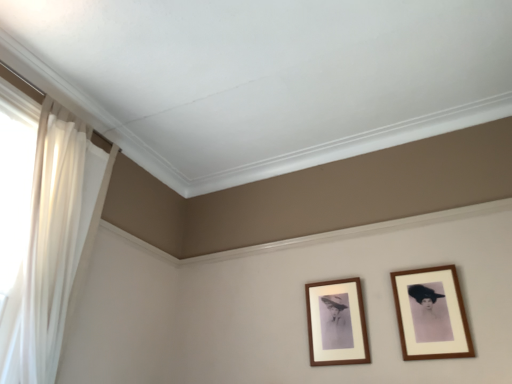
Question: Is wooden frame at center, arranged as the 1th picture frame when viewed from the left, smaller than white sheer curtain at left?

Choices:
 (A) no
 (B) yes

Answer: (B)

Question: Could white sheer curtain at left be considered to be inside wooden frame at center, the second picture frame when ordered from right to left?

Choices:
 (A) no
 (B) yes

Answer: (A)

Question: Is wooden frame at center, the second picture frame when ordered from right to left, placed right next to white sheer curtain at left?

Choices:
 (A) yes
 (B) no

Answer: (B)

Question: Is wooden frame at center, arranged as the 1th picture frame when viewed from the left, shorter than white sheer curtain at left?

Choices:
 (A) no
 (B) yes

Answer: (B)

Question: From the image's perspective, is wooden frame at center, arranged as the 1th picture frame when viewed from the left, on top of white sheer curtain at left?

Choices:
 (A) no
 (B) yes

Answer: (A)

Question: Is wooden frame at center, arranged as the 1th picture frame when viewed from the left, completely or partially outside of white sheer curtain at left?

Choices:
 (A) yes
 (B) no

Answer: (A)

Question: Does white sheer curtain at left appear on the right side of wooden frame at right, which is counted as the second picture frame, starting from the left?

Choices:
 (A) yes
 (B) no

Answer: (B)

Question: Is white sheer curtain at left in contact with wooden frame at right, which is the first picture frame from right to left?

Choices:
 (A) no
 (B) yes

Answer: (A)

Question: Would you say white sheer curtain at left is a long distance from wooden frame at right, which is counted as the second picture frame, starting from the left?

Choices:
 (A) no
 (B) yes

Answer: (B)

Question: Is white sheer curtain at left facing away from wooden frame at right, which is the first picture frame from right to left?

Choices:
 (A) yes
 (B) no

Answer: (B)

Question: Is white sheer curtain at left taller than wooden frame at right, which is counted as the second picture frame, starting from the left?

Choices:
 (A) yes
 (B) no

Answer: (A)

Question: Is white sheer curtain at left positioned beyond the bounds of wooden frame at right, which is the first picture frame from right to left?

Choices:
 (A) yes
 (B) no

Answer: (A)

Question: Are wooden frame at center, arranged as the 1th picture frame when viewed from the left, and wooden frame at right, which is the first picture frame from right to left, far apart?

Choices:
 (A) yes
 (B) no

Answer: (B)